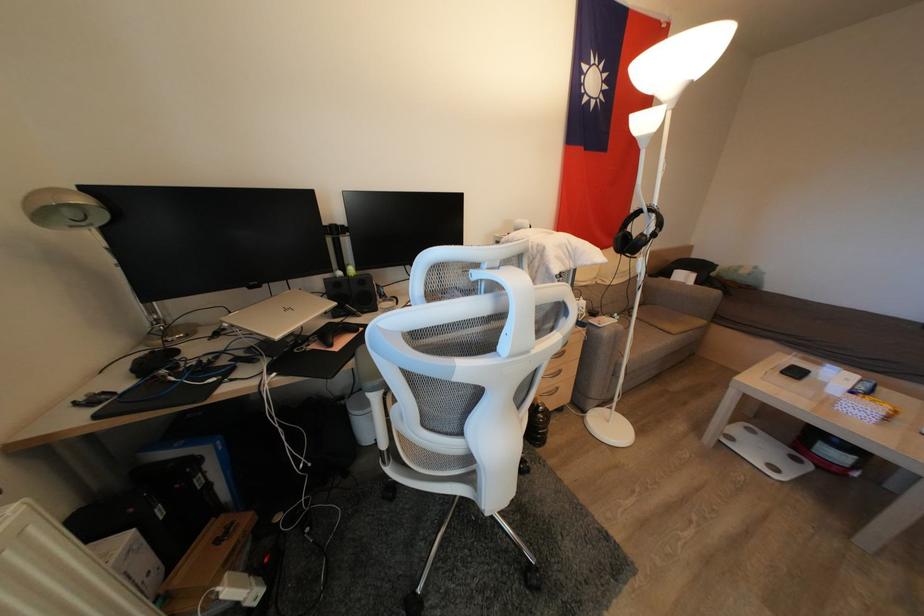
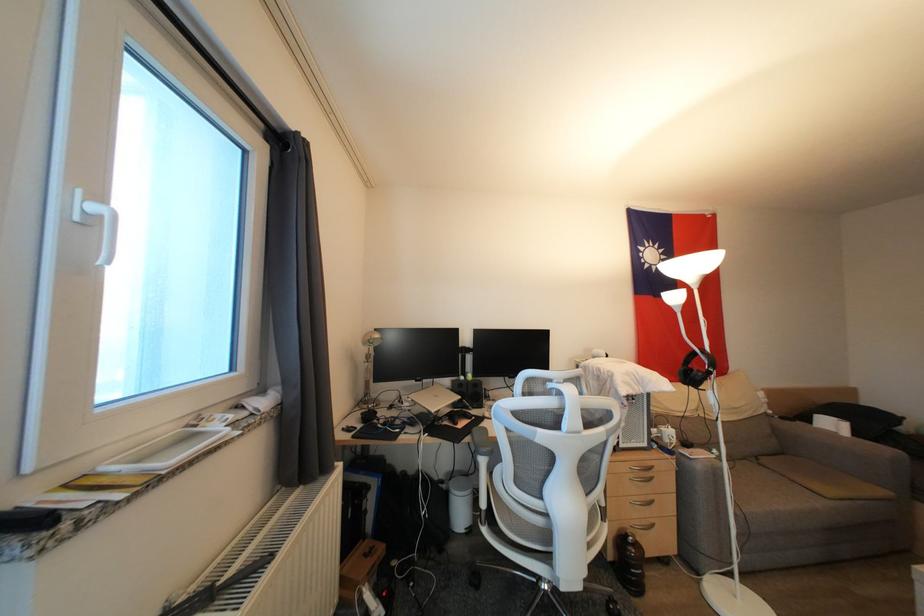
The point at (500, 496) is marked in the first image. Where is the corresponding point in the second image?

(574, 573)